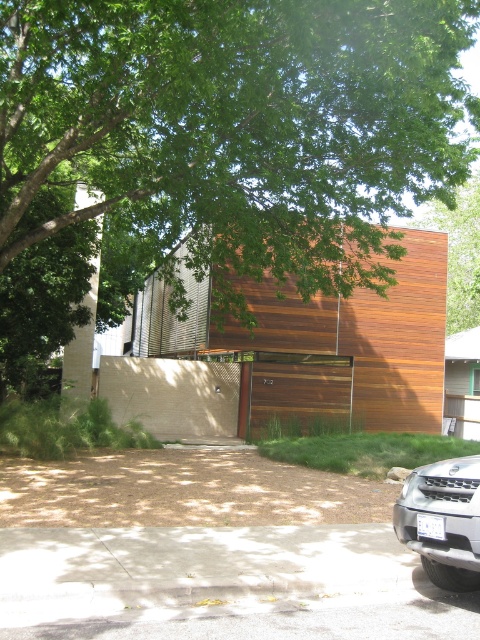
Question: Estimate the real-world distances between objects in this image. Which object is farther from the brown mulch at lower center?

Choices:
 (A) green leafy tree at upper center
 (B) wooden garage door at center
 (C) green wood at upper center
 (D) silver metallic suv at lower right

Answer: (C)

Question: Among these points, which one is farthest from the camera?

Choices:
 (A) (285, 509)
 (B) (478, 188)
 (C) (278, 380)
 (D) (12, 243)

Answer: (B)

Question: Does green leafy tree at upper center appear on the right side of silver metallic suv at lower right?

Choices:
 (A) yes
 (B) no

Answer: (B)

Question: Based on their relative distances, which object is nearer to the brown mulch at lower center?

Choices:
 (A) green wood at upper center
 (B) wooden garage door at center

Answer: (B)

Question: Can you confirm if silver metallic suv at lower right is positioned to the left of wooden garage door at center?

Choices:
 (A) yes
 (B) no

Answer: (A)

Question: Can you confirm if brown mulch at lower center is positioned below wooden garage door at center?

Choices:
 (A) no
 (B) yes

Answer: (B)